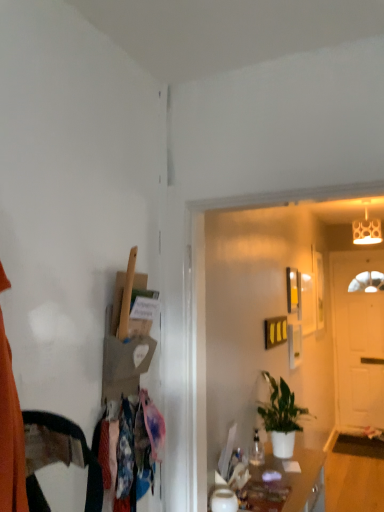
Question: Is matte white lampshade at upper right next to matte white cabinet at lower center?

Choices:
 (A) yes
 (B) no

Answer: (B)

Question: Is matte white lampshade at upper right thinner than matte white cabinet at lower center?

Choices:
 (A) yes
 (B) no

Answer: (A)

Question: Is matte white lampshade at upper right at the right side of matte white cabinet at lower center?

Choices:
 (A) no
 (B) yes

Answer: (B)

Question: Does matte white lampshade at upper right have a lesser height compared to matte white cabinet at lower center?

Choices:
 (A) yes
 (B) no

Answer: (A)

Question: Is the depth of matte white lampshade at upper right greater than that of matte white cabinet at lower center?

Choices:
 (A) yes
 (B) no

Answer: (A)

Question: Is matte white lampshade at upper right at the left side of matte white cabinet at lower center?

Choices:
 (A) yes
 (B) no

Answer: (B)

Question: From a real-world perspective, is white matte door at right below matte white lampshade at upper right?

Choices:
 (A) no
 (B) yes

Answer: (B)

Question: Could matte white lampshade at upper right be considered to be inside white matte door at right?

Choices:
 (A) no
 (B) yes

Answer: (A)

Question: Considering the relative sizes of white matte door at right and matte white lampshade at upper right in the image provided, is white matte door at right shorter than matte white lampshade at upper right?

Choices:
 (A) no
 (B) yes

Answer: (A)

Question: From the image's perspective, is white matte door at right under matte white lampshade at upper right?

Choices:
 (A) no
 (B) yes

Answer: (B)

Question: From a real-world perspective, is white matte door at right located higher than matte white lampshade at upper right?

Choices:
 (A) yes
 (B) no

Answer: (B)

Question: Is white matte door at right positioned behind matte white lampshade at upper right?

Choices:
 (A) yes
 (B) no

Answer: (A)

Question: Does matte white lampshade at upper right have a greater width compared to green matte plant at center?

Choices:
 (A) yes
 (B) no

Answer: (B)